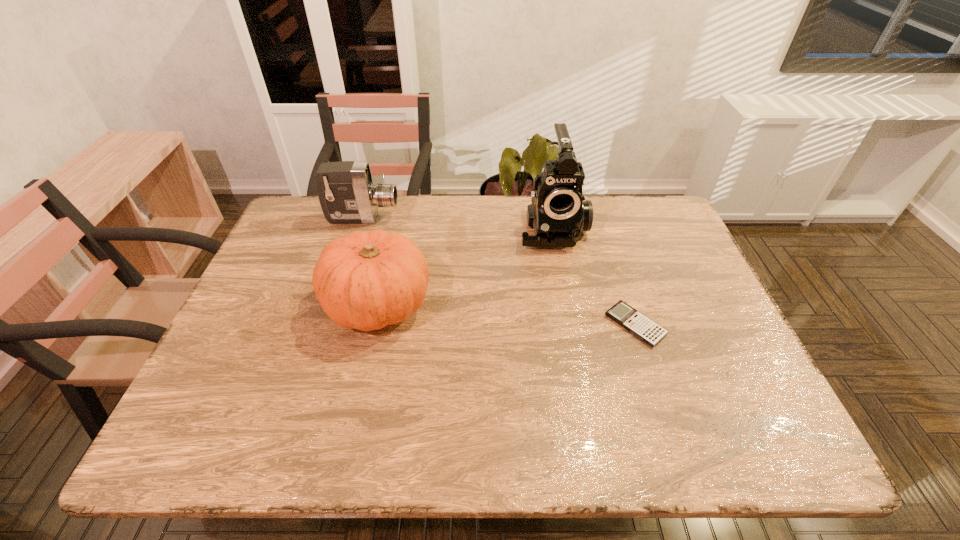
This screenshot has height=540, width=960. What are the coordinates of `free point that satisfies the following two spatial constraints: 1. at the front of the shorter camcorder, highlighting the lens; 2. on the right side of the pumpkin` in the screenshot? It's located at (336, 303).

Locate an element on the screen. The height and width of the screenshot is (540, 960). vacant region that satisfies the following two spatial constraints: 1. at the front of the pumpkin, highlighting the lens; 2. on the left side of the left camcorder is located at coordinates (336, 303).

What are the coordinates of `vacant area that satisfies the following two spatial constraints: 1. on the lens mount of the calculator; 2. on the right side of the taller camcorder` in the screenshot? It's located at (570, 325).

What are the coordinates of `free region that satisfies the following two spatial constraints: 1. on the front side of the calculator; 2. on the left side of the pumpkin` in the screenshot? It's located at (373, 325).

Where is `free space that satisfies the following two spatial constraints: 1. at the front of the shorter camcorder, highlighting the lens; 2. on the left side of the pumpkin`? The height and width of the screenshot is (540, 960). free space that satisfies the following two spatial constraints: 1. at the front of the shorter camcorder, highlighting the lens; 2. on the left side of the pumpkin is located at coordinates (336, 303).